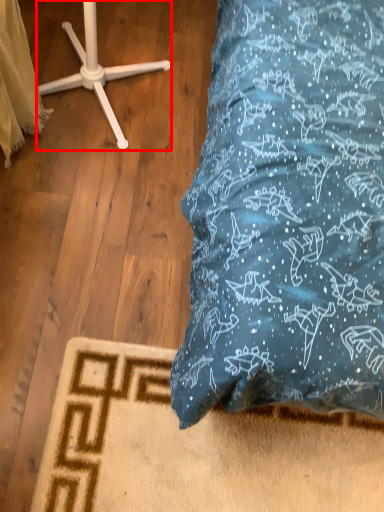
Question: From the image's perspective, what is the correct spatial relationship of furniture (annotated by the red box) in relation to material?

Choices:
 (A) below
 (B) above

Answer: (B)